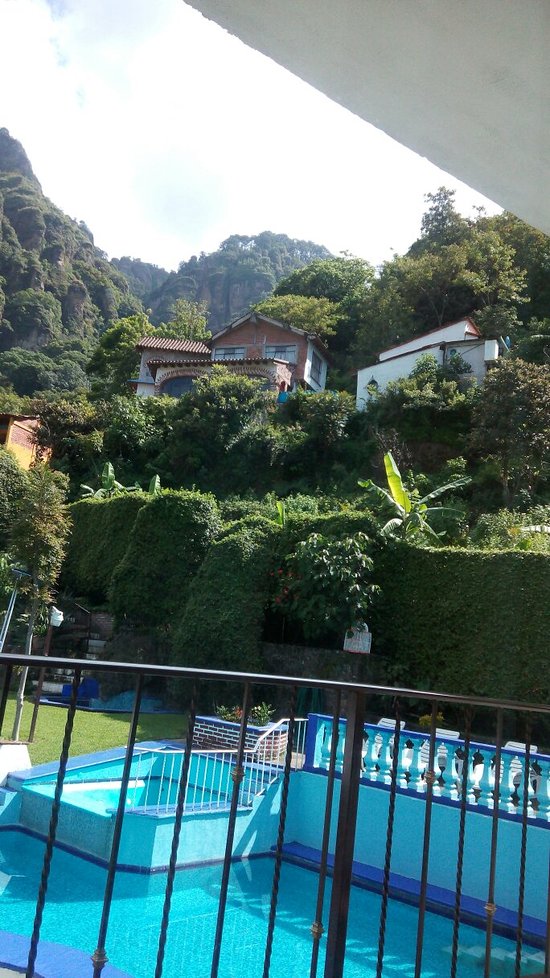
In order to click on stairway in this screenshot , I will do `click(258, 785)`, `click(96, 643)`.